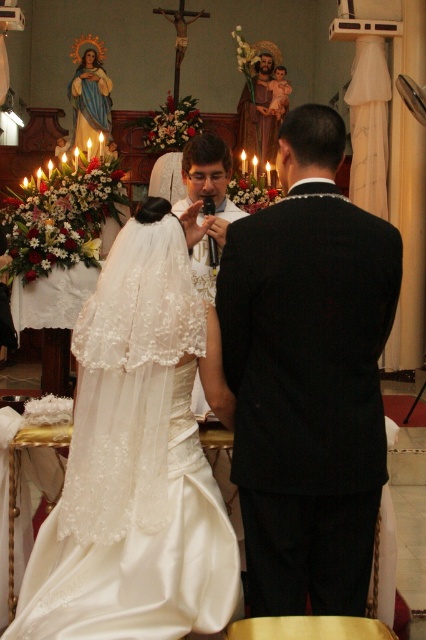
Question: Is black wool suit at center positioned before matte white veil at upper left?

Choices:
 (A) yes
 (B) no

Answer: (A)

Question: Which object is closer to the camera taking this photo?

Choices:
 (A) black wool suit at center
 (B) matte black vest at center
 (C) satin/embroidered dress at center
 (D) matte white veil at upper left

Answer: (C)

Question: Which is nearer to the matte black vest at center?

Choices:
 (A) matte white veil at upper left
 (B) satin/embroidered dress at center
 (C) black wool suit at center

Answer: (C)

Question: Is black wool suit at center to the left of satin/embroidered dress at center from the viewer's perspective?

Choices:
 (A) yes
 (B) no

Answer: (B)

Question: Which point is farther to the camera?

Choices:
 (A) (196, 580)
 (B) (282, 605)
 (C) (74, 99)
 (D) (215, 164)

Answer: (C)

Question: Is black wool suit at center above matte black vest at center?

Choices:
 (A) yes
 (B) no

Answer: (B)